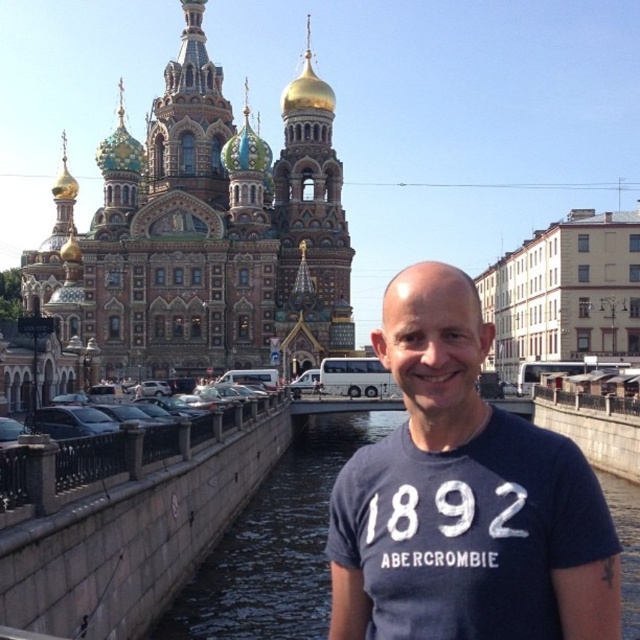
Which is above, golden domed church at upper left or dark blue t-shirt at center?

golden domed church at upper left

Does golden domed church at upper left appear on the right side of dark blue t-shirt at center?

No, golden domed church at upper left is not to the right of dark blue t-shirt at center.

Describe the element at coordinates (204, 234) in the screenshot. I see `golden domed church at upper left` at that location.

The image size is (640, 640). In order to click on golden domed church at upper left in this screenshot , I will do `click(204, 234)`.

Between point (413, 369) and point (321, 625), which one is positioned in front?

Point (413, 369) is more forward.

Is point (419, 472) more distant than point (627, 627)?

No, (419, 472) is closer to viewer.

This screenshot has height=640, width=640. In order to click on dark blue t-shirt at center in this screenshot , I will do `click(465, 497)`.

The width and height of the screenshot is (640, 640). In order to click on dark blue t-shirt at center in this screenshot , I will do [465, 497].

Between point (307, 108) and point (156, 627), which one is positioned behind?

The point (307, 108) is more distant.

Is golden domed church at upper left smaller than dark gray concrete river at center?

Actually, golden domed church at upper left might be larger than dark gray concrete river at center.

Locate an element on the screen. The image size is (640, 640). golden domed church at upper left is located at coordinates (204, 234).